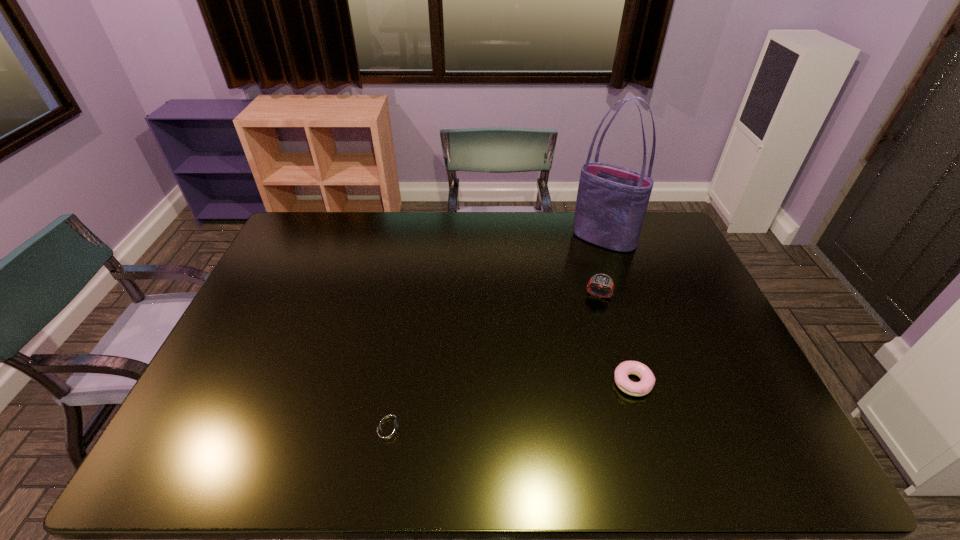
Locate an element on the screen. The width and height of the screenshot is (960, 540). the tallest object is located at coordinates (611, 204).

Find the location of a particular element. tote bag is located at coordinates (611, 204).

I want to click on the farther watch, so click(x=600, y=281).

This screenshot has height=540, width=960. Find the location of `the third nearest object`. the third nearest object is located at coordinates (600, 281).

Image resolution: width=960 pixels, height=540 pixels. In order to click on doughnut in this screenshot , I will do coord(643,387).

This screenshot has height=540, width=960. What are the coordinates of `the third tallest object` in the screenshot? It's located at (643, 387).

The height and width of the screenshot is (540, 960). I want to click on the nearer watch, so click(388, 427).

Locate an element on the screen. This screenshot has height=540, width=960. the shortest object is located at coordinates (388, 427).

This screenshot has height=540, width=960. I want to click on vacant area located on the front of the tote bag, so click(639, 342).

You are a GUI agent. You are given a task and a screenshot of the screen. Output one action in this format:
    pyautogui.click(x=<x>, y=<y>)
    Task: Click on the free point located on the front of the farther watch
    This screenshot has width=960, height=540.
    Given the screenshot: What is the action you would take?
    pyautogui.click(x=604, y=314)